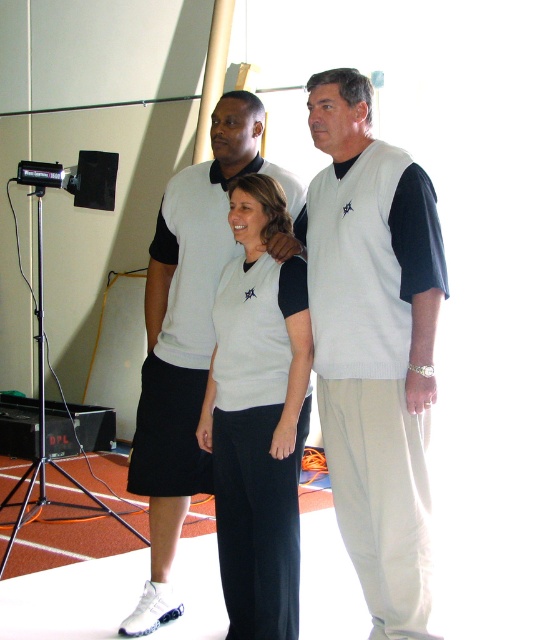
Please provide the coordinates of the white knit vest at center in the image.

The white knit vest at center is located at coordinates point [259,417].

You are a fashion designer observing the image of two people wearing white tops. You notice both have a white knitted vest at center and a white knit sweater at center. Which clothing item is positioned higher on their bodies?

The white knitted vest at center is positioned higher because it is above the white knit sweater at center.

You are organizing a team photo and need to arrange two team members wearing white knit garments. The scene shows a white knit vest at center and a white knit sweater at center. Which garment is on the right side when viewed from the front?

The white knit vest at center is positioned on the right side of the white knit sweater at center, so the vest is on the right when viewed from the front.